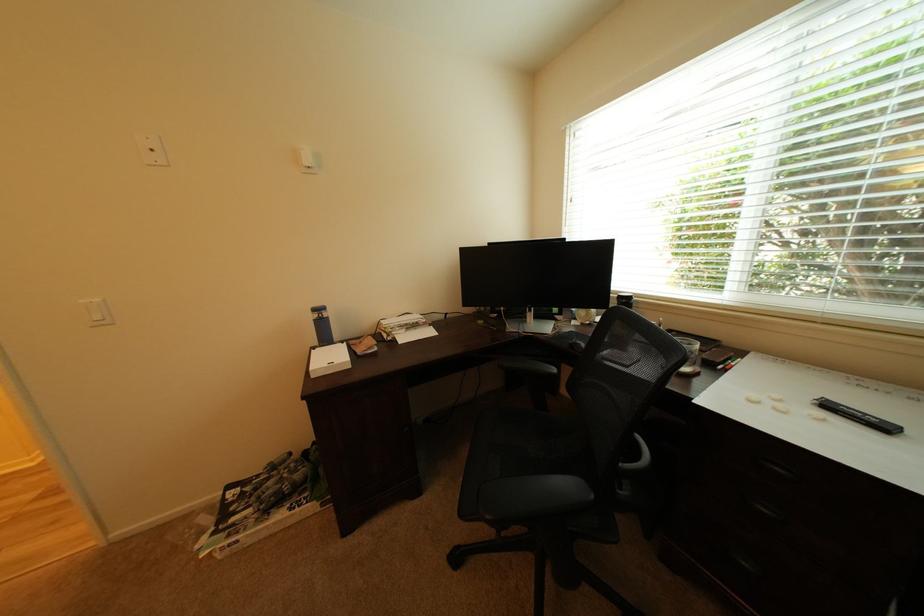
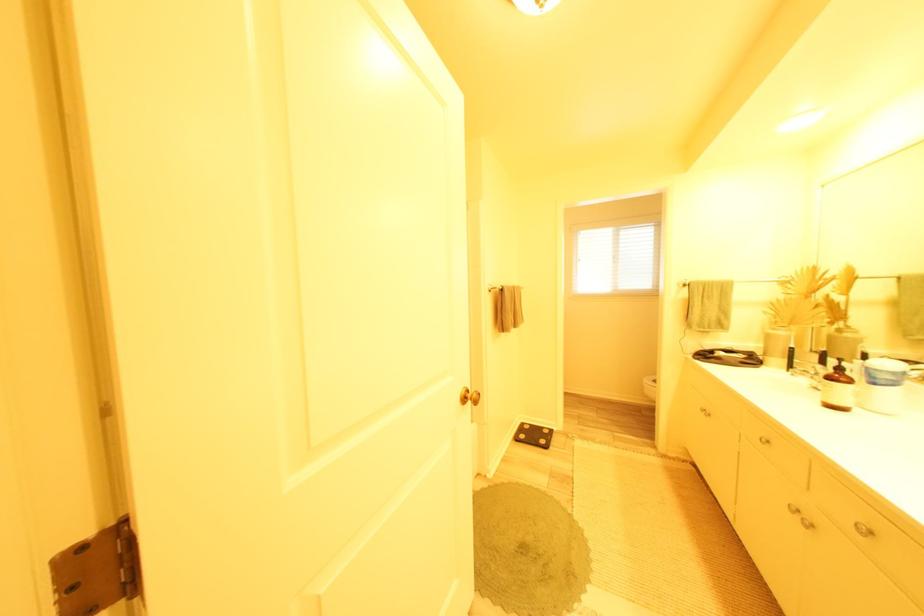
Question: I am providing you with two images of the same scene from different viewpoints. Which of the following objects are not visible in image2?

Choices:
 (A) clear glass cup
 (B) brown bottle pump
 (C) black floor scale
 (D) red juicer handle

Answer: (A)